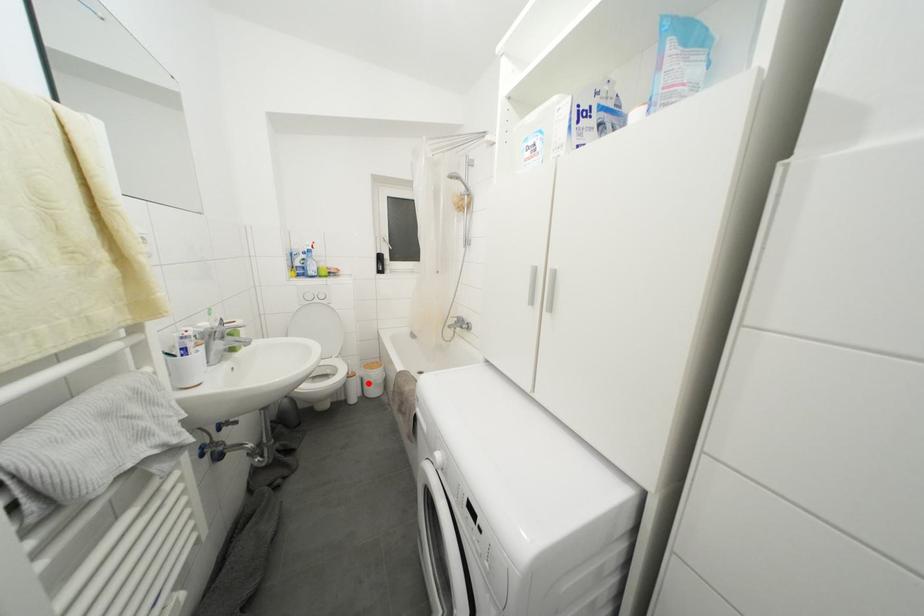
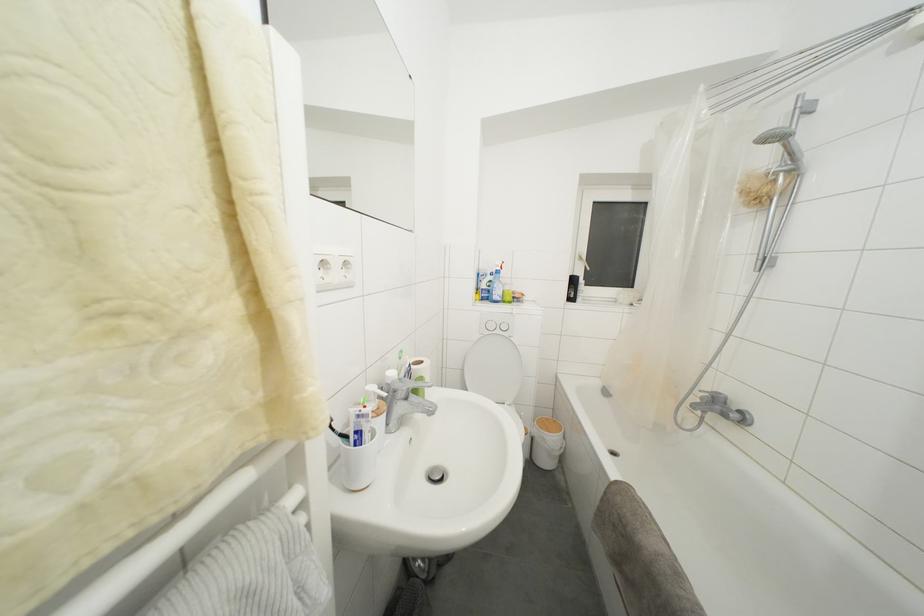
In the second image, find the point that corresponds to the highlighted location in the first image.

(541, 445)